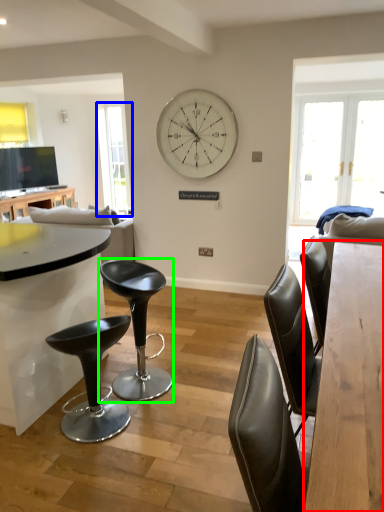
Question: Which object is positioned farthest from table (highlighted by a red box)? Select from window screen (highlighted by a blue box) and chair (highlighted by a green box).

Choices:
 (A) window screen
 (B) chair

Answer: (A)